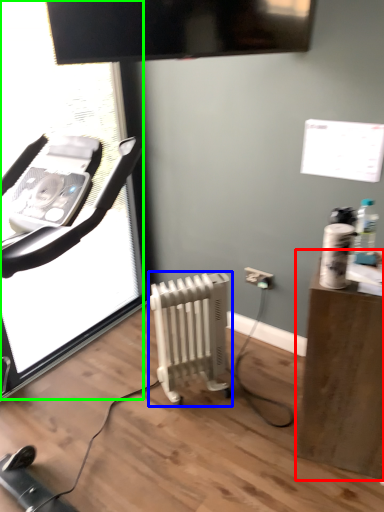
Question: Which object is the farthest from furniture (highlighted by a red box)? Choose among these: radiator (highlighted by a blue box) or screen door (highlighted by a green box).

Choices:
 (A) radiator
 (B) screen door

Answer: (B)